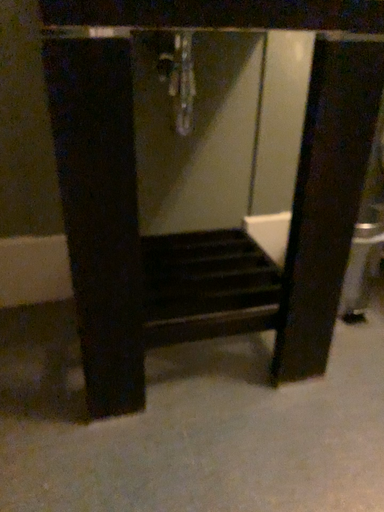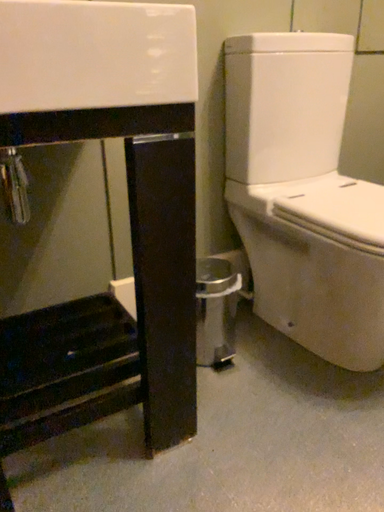
Question: Which way did the camera rotate in the video?

Choices:
 (A) rotated left
 (B) rotated right

Answer: (B)